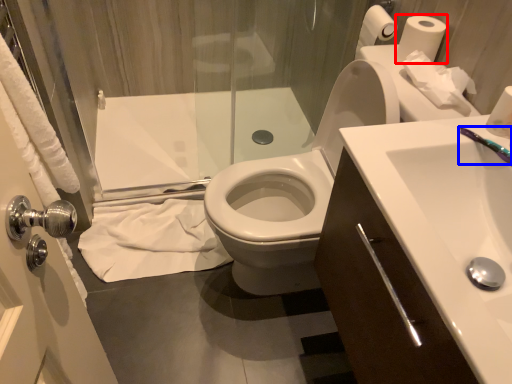
Question: Which of the following is the farthest to the observer, toilet paper (highlighted by a red box) or toothbrush (highlighted by a blue box)?

Choices:
 (A) toilet paper
 (B) toothbrush

Answer: (A)